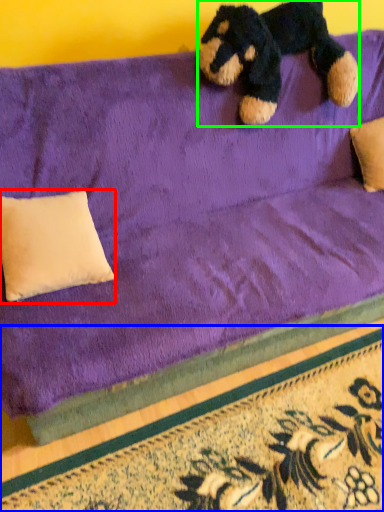
Question: Estimate the real-world distances between objects in this image. Which object is farther from pillow (highlighted by a red box), doormat (highlighted by a blue box) or teddy bear (highlighted by a green box)?

Choices:
 (A) doormat
 (B) teddy bear

Answer: (B)